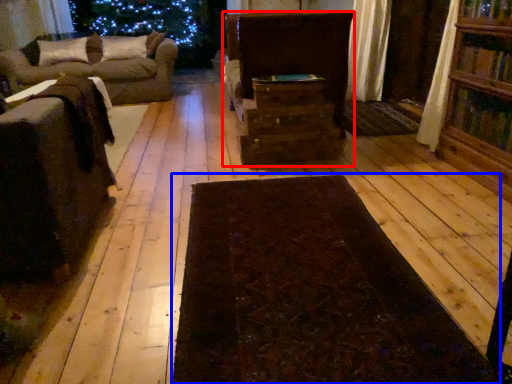
Question: Which object appears farthest to the camera in this image, furniture (highlighted by a red box) or mat (highlighted by a blue box)?

Choices:
 (A) furniture
 (B) mat

Answer: (A)